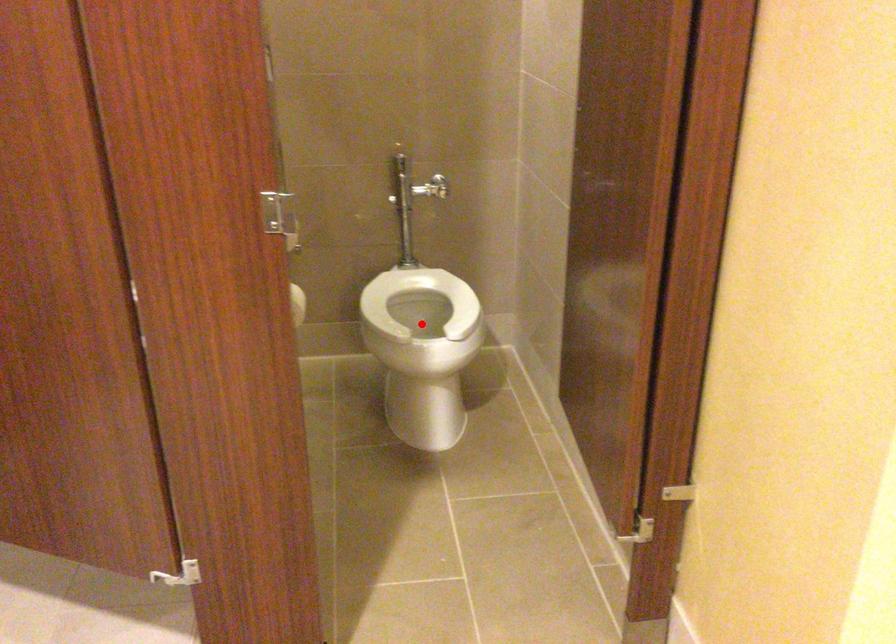
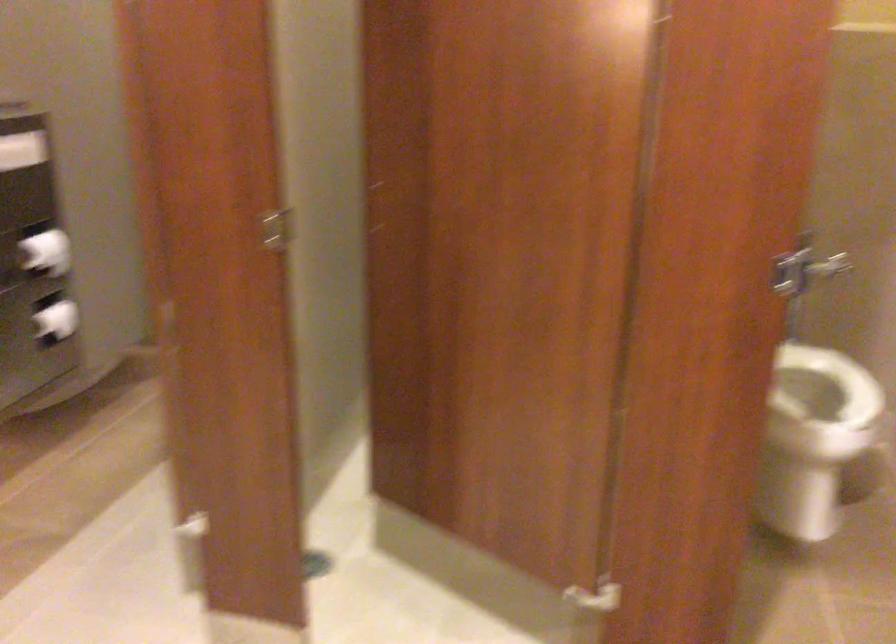
Locate, in the second image, the point that corresponds to the highlighted location in the first image.

(811, 393)